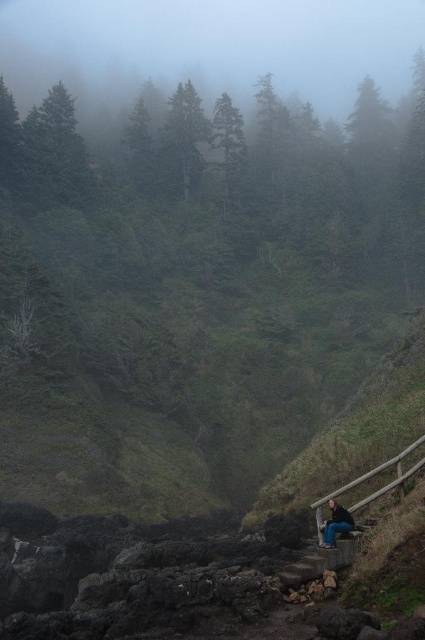
Question: Is foggy translucent forest at upper center smaller than green matte tree at upper left?

Choices:
 (A) yes
 (B) no

Answer: (B)

Question: Does foggy translucent forest at upper center appear on the left side of green matte tree at upper left?

Choices:
 (A) no
 (B) yes

Answer: (B)

Question: Among these points, which one is nearest to the camera?

Choices:
 (A) (82, 186)
 (B) (333, 531)

Answer: (B)

Question: Which object is the farthest from the green matte tree at upper left?

Choices:
 (A) foggy translucent forest at upper center
 (B) jeans at lower center

Answer: (A)

Question: Which of the following is the farthest from the observer?

Choices:
 (A) (399, 20)
 (B) (346, 518)
 (C) (73, 109)

Answer: (A)

Question: Is green matte tree at upper left above jeans at lower center?

Choices:
 (A) no
 (B) yes

Answer: (B)